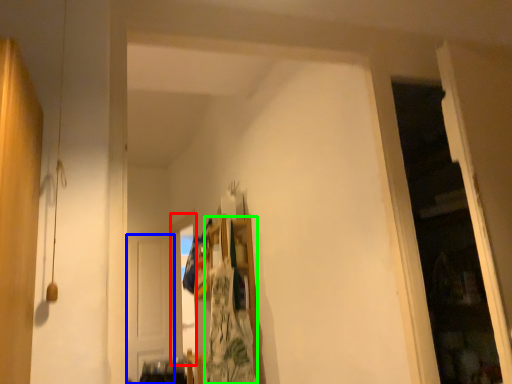
Question: Estimate the real-world distances between objects in this image. Which object is farther from window (highlighted by a red box), door (highlighted by a blue box) or laundry (highlighted by a green box)?

Choices:
 (A) door
 (B) laundry

Answer: (B)